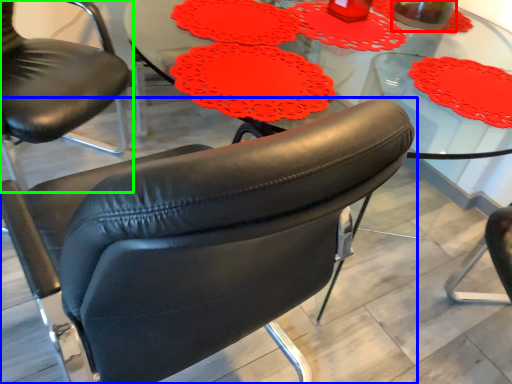
Question: Based on their relative distances, which object is nearer to beverage (highlighted by a red box)? Choose from chair (highlighted by a blue box) and chair (highlighted by a green box).

Choices:
 (A) chair
 (B) chair

Answer: (B)